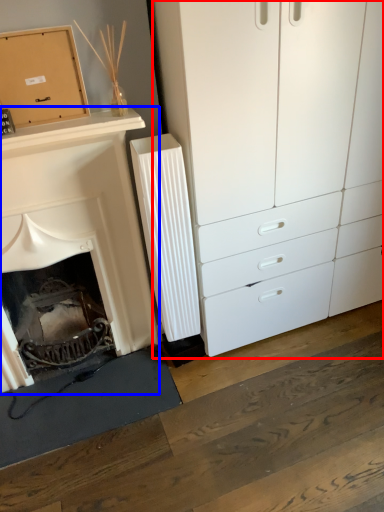
Question: Which point is further to the camera, chest of drawers (highlighted by a red box) or fireplace (highlighted by a blue box)?

Choices:
 (A) chest of drawers
 (B) fireplace

Answer: (B)